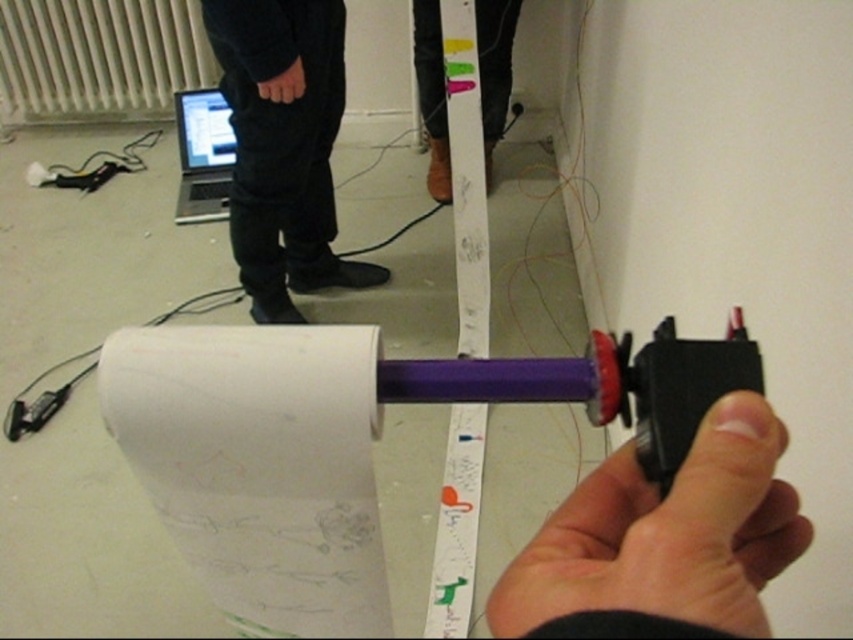
You are a technician working on a project and need to determine the relative sizes of objects in the image. Which object is shorter between the black matte hand at center and the white textured radiator at upper left?

The black matte hand at center is shorter than the white textured radiator at upper left according to the description.

You are a robot with a height of 1.5 meters. You are standing at the position of the black fabric pants at center. Can you reach the white textured radiator at upper left without moving your feet?

The distance between the black fabric pants at center and the white textured radiator at upper left is 1.14 meters. Since the robot is 1.5 meters tall, it can reach the radiator as its height exceeds the distance required.